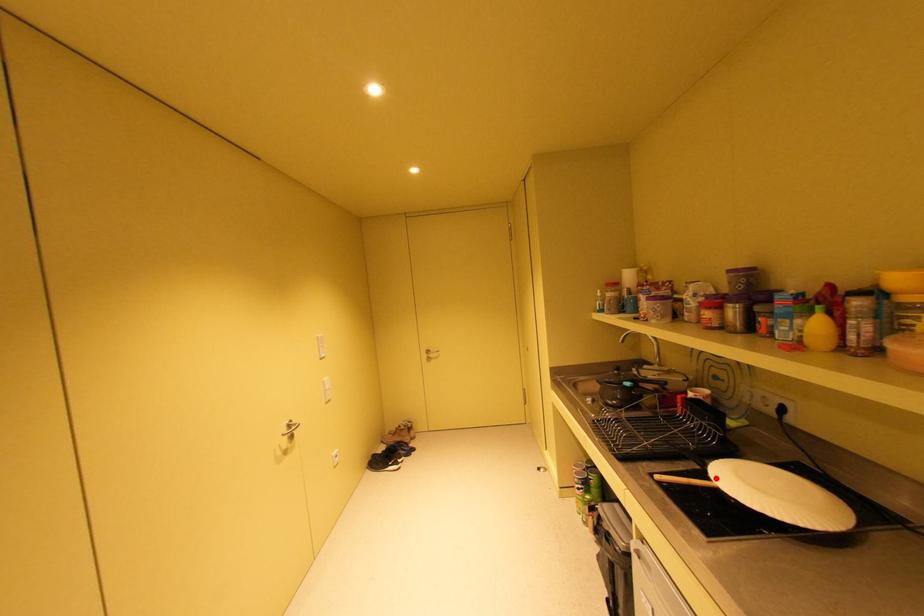
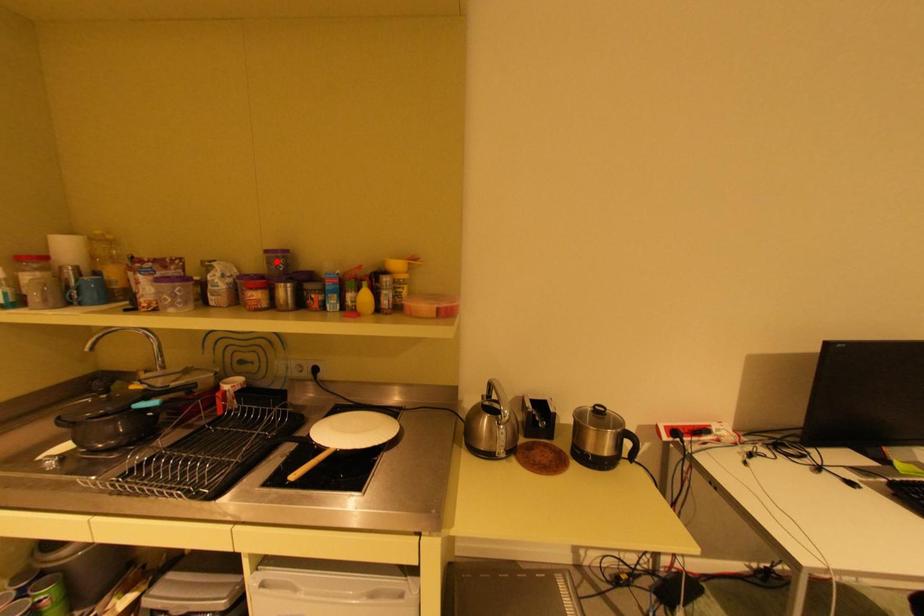
I am providing you with two images of the same scene from different viewpoints. A red point is marked on the first image and another point is marked on the second image. Does the point marked in image1 correspond to the same location as the one in image2?

No